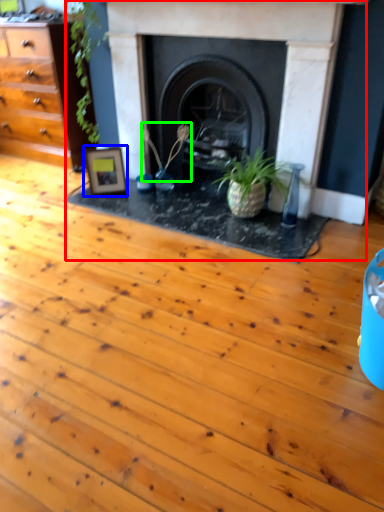
Question: Considering the real-world distances, which object is closest to fireplace (highlighted by a red box)? picture frame (highlighted by a blue box) or plant (highlighted by a green box).

Choices:
 (A) picture frame
 (B) plant

Answer: (B)